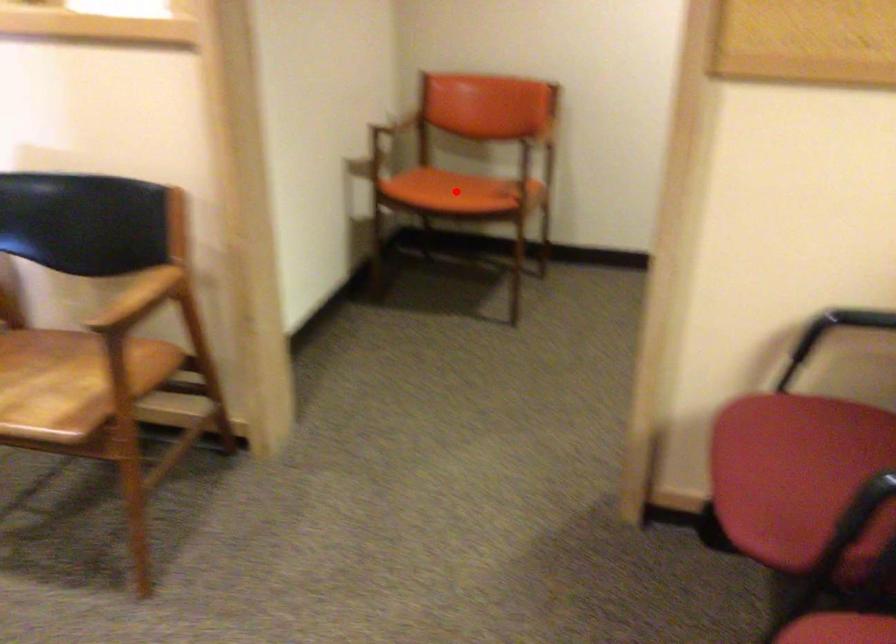
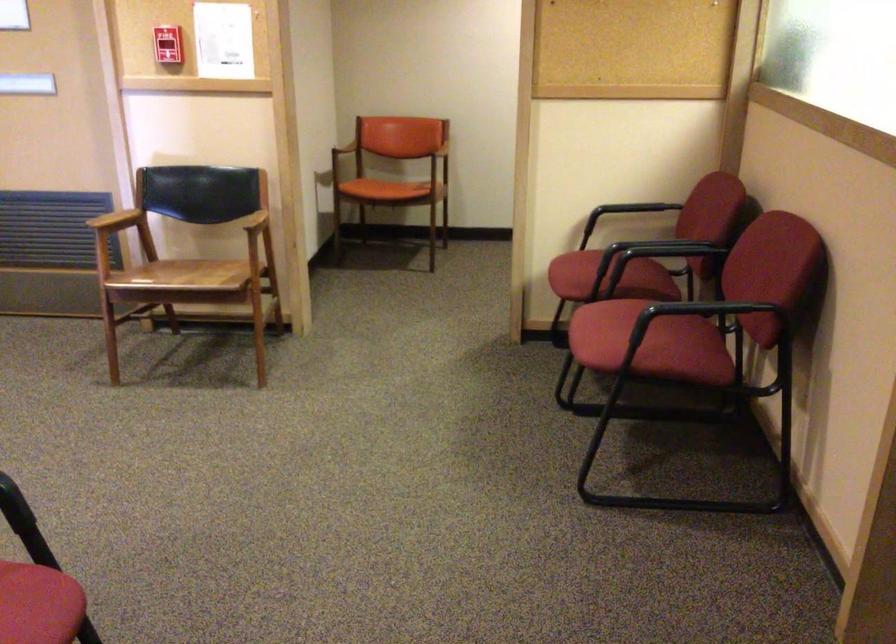
In the second image, find the point that corresponds to the highlighted location in the first image.

(392, 183)